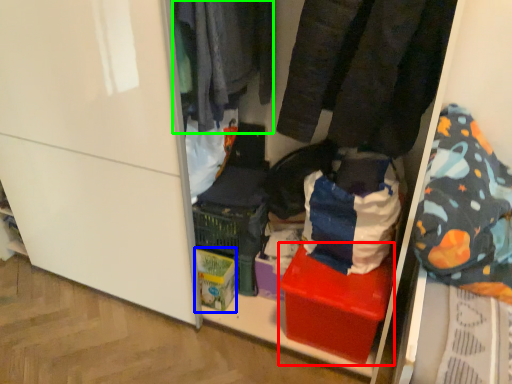
Question: Estimate the real-world distances between objects in this image. Which object is farther from box (highlighted by a red box), cardboard box (highlighted by a blue box) or clothing (highlighted by a green box)?

Choices:
 (A) cardboard box
 (B) clothing

Answer: (B)